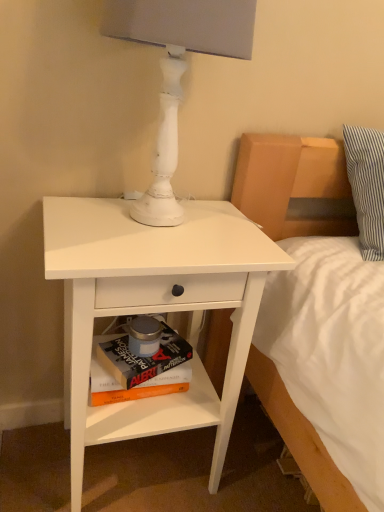
Question: Is white painted wood table lamp at upper center further to camera compared to white matte nightstand at lower left?

Choices:
 (A) no
 (B) yes

Answer: (A)

Question: Would you say white matte nightstand at lower left is part of white painted wood table lamp at upper center's contents?

Choices:
 (A) no
 (B) yes

Answer: (A)

Question: Does white painted wood table lamp at upper center have a larger size compared to white matte nightstand at lower left?

Choices:
 (A) no
 (B) yes

Answer: (A)

Question: Is white painted wood table lamp at upper center located outside white matte nightstand at lower left?

Choices:
 (A) no
 (B) yes

Answer: (B)

Question: Can you confirm if white painted wood table lamp at upper center is positioned to the right of white matte nightstand at lower left?

Choices:
 (A) no
 (B) yes

Answer: (B)

Question: In terms of height, does hardcover book at lower center, positioned as the 1th paperback book in bottom-to-top order, look taller or shorter compared to hardcover book at lower center, positioned as the 1th paperback book in top-to-bottom order?

Choices:
 (A) short
 (B) tall

Answer: (B)

Question: Would you say hardcover book at lower center, arranged as the 2th paperback book when viewed from the top, is to the left or to the right of hardcover book at lower center, positioned as the 1th paperback book in top-to-bottom order, in the picture?

Choices:
 (A) left
 (B) right

Answer: (A)

Question: Which is correct: hardcover book at lower center, positioned as the 1th paperback book in bottom-to-top order, is inside hardcover book at lower center, the 2th paperback book in the bottom-to-top sequence, or outside of it?

Choices:
 (A) inside
 (B) outside

Answer: (B)

Question: Does point (107, 373) appear closer or farther from the camera than point (104, 346)?

Choices:
 (A) farther
 (B) closer

Answer: (B)

Question: Considering their positions, is hardcover book at lower center, the 2th paperback book in the bottom-to-top sequence, located in front of or behind hardcover book at lower center, arranged as the 2th paperback book when viewed from the top?

Choices:
 (A) front
 (B) behind

Answer: (A)

Question: Considering the positions of point (168, 362) and point (148, 390), is point (168, 362) closer or farther from the camera than point (148, 390)?

Choices:
 (A) closer
 (B) farther

Answer: (A)

Question: Looking at their shapes, would you say hardcover book at lower center, positioned as the 1th paperback book in top-to-bottom order, is wider or thinner than hardcover book at lower center, arranged as the 2th paperback book when viewed from the top?

Choices:
 (A) thin
 (B) wide

Answer: (B)

Question: Is hardcover book at lower center, positioned as the 1th paperback book in top-to-bottom order, spatially inside hardcover book at lower center, positioned as the 1th paperback book in bottom-to-top order, or outside of it?

Choices:
 (A) inside
 (B) outside

Answer: (B)

Question: From the image's perspective, is hardcover book at lower center, positioned as the 1th paperback book in bottom-to-top order, above or below white painted wood table lamp at upper center?

Choices:
 (A) above
 (B) below

Answer: (B)

Question: Looking at the image, does hardcover book at lower center, positioned as the 1th paperback book in bottom-to-top order, seem bigger or smaller compared to white painted wood table lamp at upper center?

Choices:
 (A) big
 (B) small

Answer: (B)